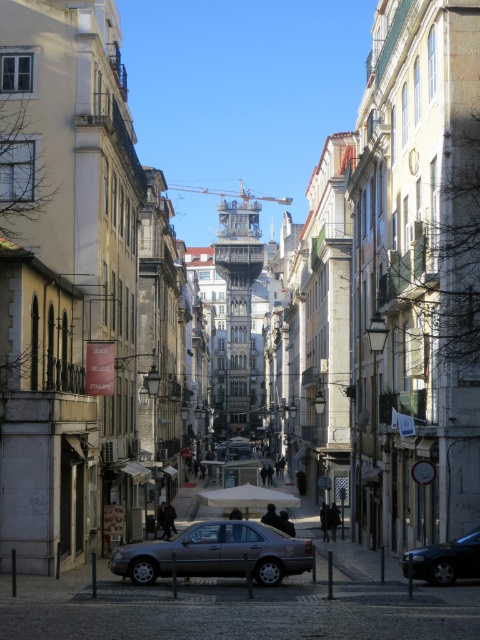
The width and height of the screenshot is (480, 640). What do you see at coordinates (216, 554) in the screenshot?
I see `metallic gray sedan at center` at bounding box center [216, 554].

Can you confirm if metallic gray sedan at center is positioned above dark gray metallic car at lower right?

Correct, metallic gray sedan at center is located above dark gray metallic car at lower right.

Is point (204, 573) farther from viewer compared to point (420, 561)?

That is True.

Identify the location of metallic gray sedan at center. This screenshot has height=640, width=480. pyautogui.click(x=216, y=554).